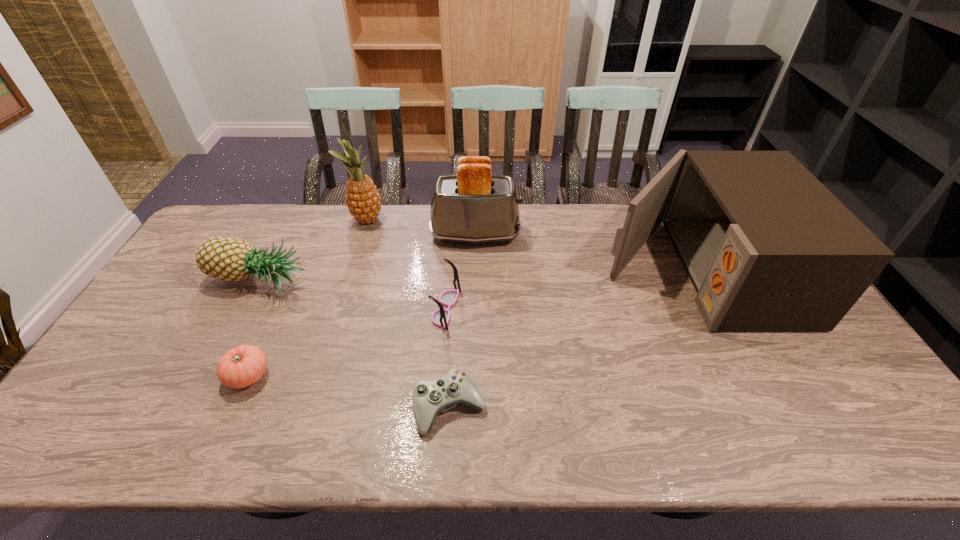
You are a GUI agent. You are given a task and a screenshot of the screen. Output one action in this format:
    pyautogui.click(x=<x>, y=<y>)
    Task: Click on the fifth object from right to left
    
    Given the screenshot: What is the action you would take?
    pyautogui.click(x=363, y=200)

Locate an element on the screen. This screenshot has width=960, height=540. the taller pineapple is located at coordinates (363, 200).

Find the location of a particular element. Image resolution: width=960 pixels, height=540 pixels. toaster is located at coordinates (473, 206).

The width and height of the screenshot is (960, 540). I want to click on microwave oven, so click(x=767, y=246).

Where is `the fourth tallest object`? This screenshot has height=540, width=960. the fourth tallest object is located at coordinates (231, 259).

The height and width of the screenshot is (540, 960). Find the location of `the left pineapple`. the left pineapple is located at coordinates (231, 259).

Where is `the third shortest object`? This screenshot has height=540, width=960. the third shortest object is located at coordinates (440, 317).

At what (x,y) coordinates should I click in order to perform the action: click on tomato. Please return your answer as a coordinate pair (x, y). The width and height of the screenshot is (960, 540). Looking at the image, I should click on (242, 366).

Identify the location of control. Image resolution: width=960 pixels, height=540 pixels. 430,398.

Where is `vacant region located on the front of the right pineapple`? The width and height of the screenshot is (960, 540). vacant region located on the front of the right pineapple is located at coordinates (343, 299).